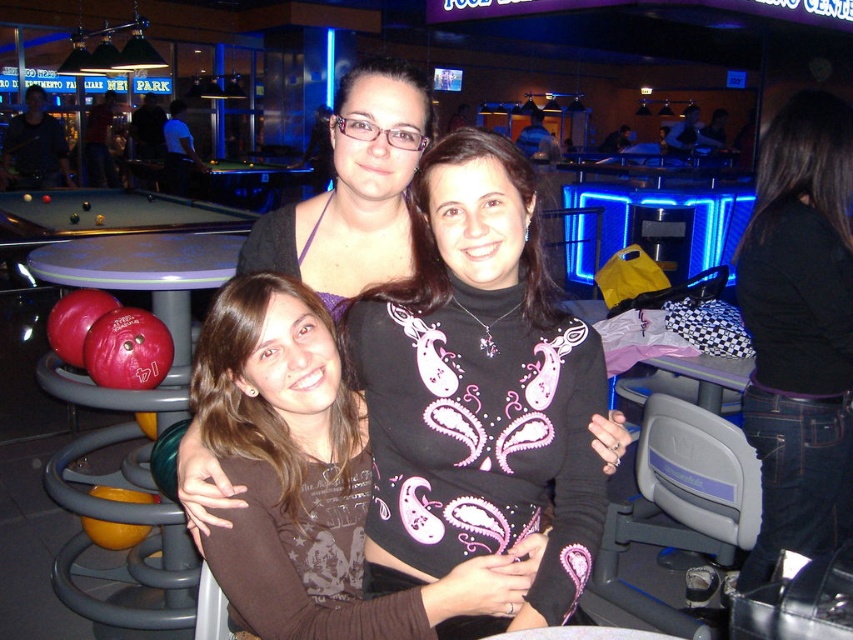
Is the position of brown fabric shirt at center more distant than that of matte black top at center?

No.

The width and height of the screenshot is (853, 640). Describe the element at coordinates (303, 474) in the screenshot. I see `brown fabric shirt at center` at that location.

Does point (485, 605) come in front of point (325, 276)?

That is True.

Where is `brown fabric shirt at center`? brown fabric shirt at center is located at coordinates (303, 474).

Does brown fabric shirt at center appear on the left side of black denim jeans at lower right?

Indeed, brown fabric shirt at center is positioned on the left side of black denim jeans at lower right.

Can you confirm if brown fabric shirt at center is shorter than black denim jeans at lower right?

Indeed, brown fabric shirt at center has a lesser height compared to black denim jeans at lower right.

Where is `brown fabric shirt at center`? This screenshot has width=853, height=640. brown fabric shirt at center is located at coordinates (303, 474).

Who is positioned more to the right, black denim jeans at lower right or matte black top at center?

black denim jeans at lower right is more to the right.

Is black denim jeans at lower right to the right of matte black top at center from the viewer's perspective?

Correct, you'll find black denim jeans at lower right to the right of matte black top at center.

Is point (805, 122) positioned after point (428, 88)?

That is True.

Image resolution: width=853 pixels, height=640 pixels. Identify the location of black denim jeans at lower right. (799, 330).